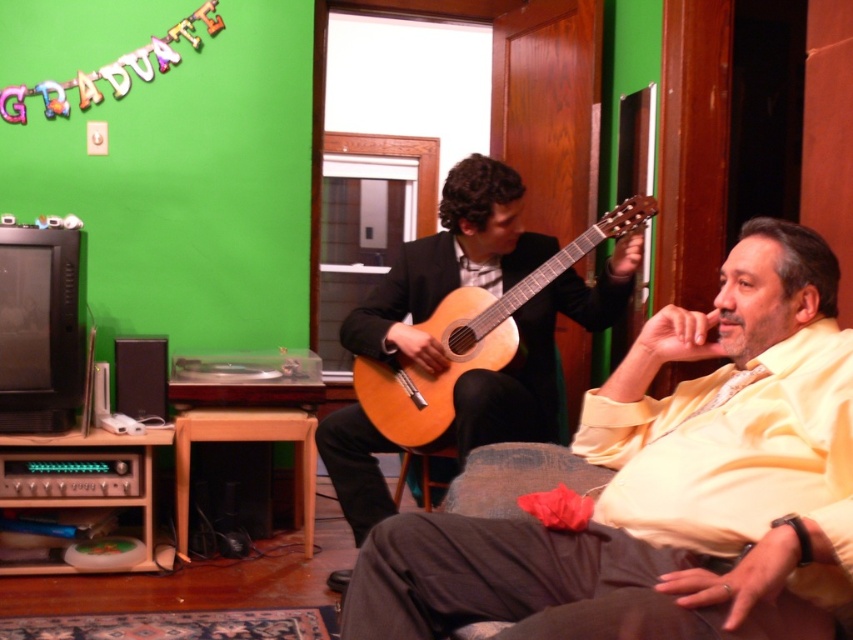
Question: Can you confirm if matte yellow shirt at center is positioned to the right of light brown wood guitar at center?

Choices:
 (A) no
 (B) yes

Answer: (B)

Question: Which of the following is the closest to the observer?

Choices:
 (A) light brown wood guitar at center
 (B) wooden stool at lower center

Answer: (A)

Question: Where is matte yellow shirt at center located in relation to wooden stool at lower center in the image?

Choices:
 (A) left
 (B) right

Answer: (B)

Question: Which of these objects is positioned farthest from the wooden stool at lower center?

Choices:
 (A) matte yellow shirt at center
 (B) light brown wood guitar at center

Answer: (A)

Question: Which point is closer to the camera?

Choices:
 (A) light brown wood guitar at center
 (B) matte yellow shirt at center
 (C) wooden stool at lower center

Answer: (B)

Question: Observing the image, what is the correct spatial positioning of matte yellow shirt at center in reference to light brown wood guitar at center?

Choices:
 (A) above
 (B) below

Answer: (B)